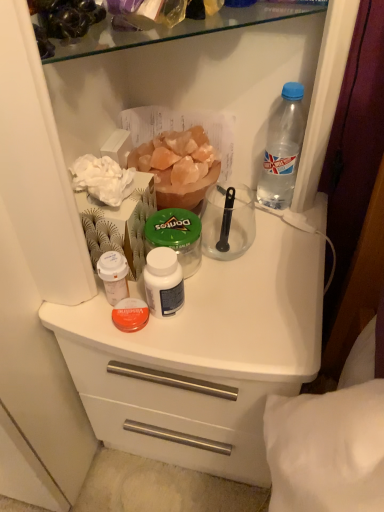
Find the location of a particular element. vacant space situated on the left part of transparent plastic bottle at upper right, the 2th bottle ordered from the bottom is located at coordinates (233, 203).